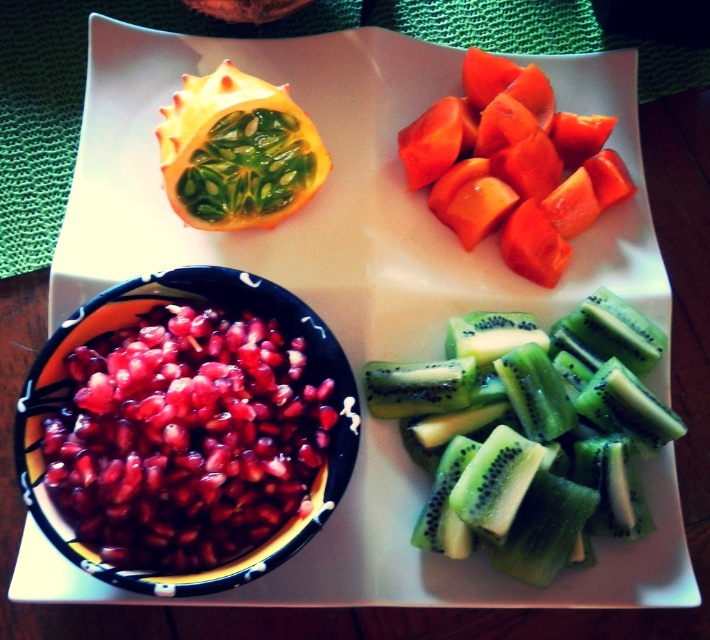
You are a food stylist arranging fruits on a plate. You need to place a new fruit between the pomegranate seeds at center and the green matte passion fruit at upper left. Based on their heights, where should you place the new fruit to maintain a descending height order from tallest to shortest?

The pomegranate seeds at center are much taller than the green matte passion fruit at upper left. To maintain a descending height order, place the new fruit between them so it is shorter than the pomegranate seeds at center but taller than the green matte passion fruit at upper left.